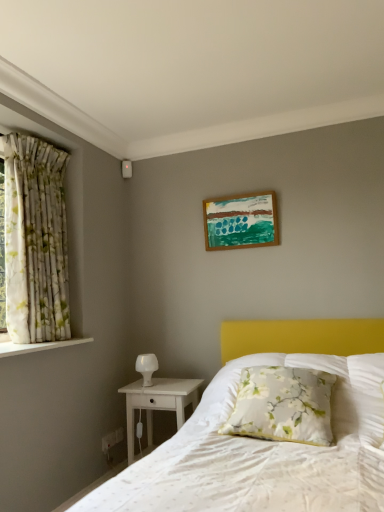
Question: Is point (243, 241) positioned closer to the camera than point (297, 399)?

Choices:
 (A) farther
 (B) closer

Answer: (A)

Question: From a real-world perspective, is wooden picture frame at upper center physically located above or below floral fabric pillow at center?

Choices:
 (A) above
 (B) below

Answer: (A)

Question: Estimate the real-world distances between objects in this image. Which object is closer to the white frosted glass table lamp at lower left?

Choices:
 (A) floral fabric curtain at left
 (B) floral fabric pillow at center
 (C) wooden picture frame at upper center
 (D) white wood nightstand at lower left

Answer: (D)

Question: Which object is positioned farthest from the wooden picture frame at upper center?

Choices:
 (A) floral fabric curtain at left
 (B) white wood nightstand at lower left
 (C) floral fabric pillow at center
 (D) white frosted glass table lamp at lower left

Answer: (C)